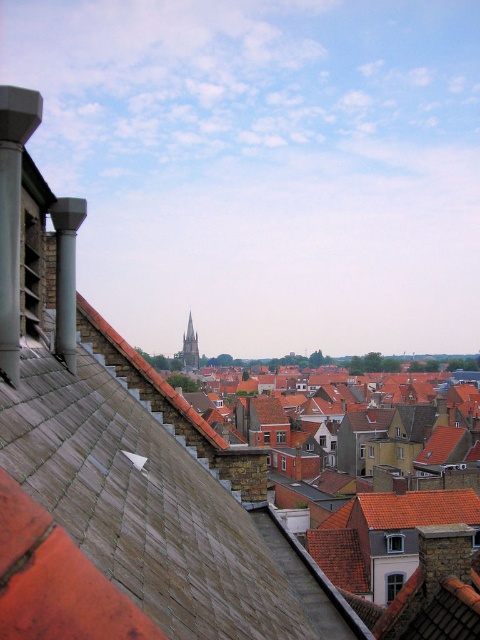
Question: Is brown tiled roofs at center positioned behind smooth gray stone tower at center?

Choices:
 (A) yes
 (B) no

Answer: (B)

Question: Does brown tiled roofs at center appear on the right side of smooth gray stone tower at center?

Choices:
 (A) yes
 (B) no

Answer: (A)

Question: Is brown tiled roofs at center bigger than smooth gray stone tower at center?

Choices:
 (A) yes
 (B) no

Answer: (B)

Question: Which object appears closest to the camera in this image?

Choices:
 (A) smooth gray stone tower at center
 (B) brown tiled roofs at center

Answer: (B)

Question: Which point is farther to the camera?

Choices:
 (A) (420, 554)
 (B) (190, 312)

Answer: (B)